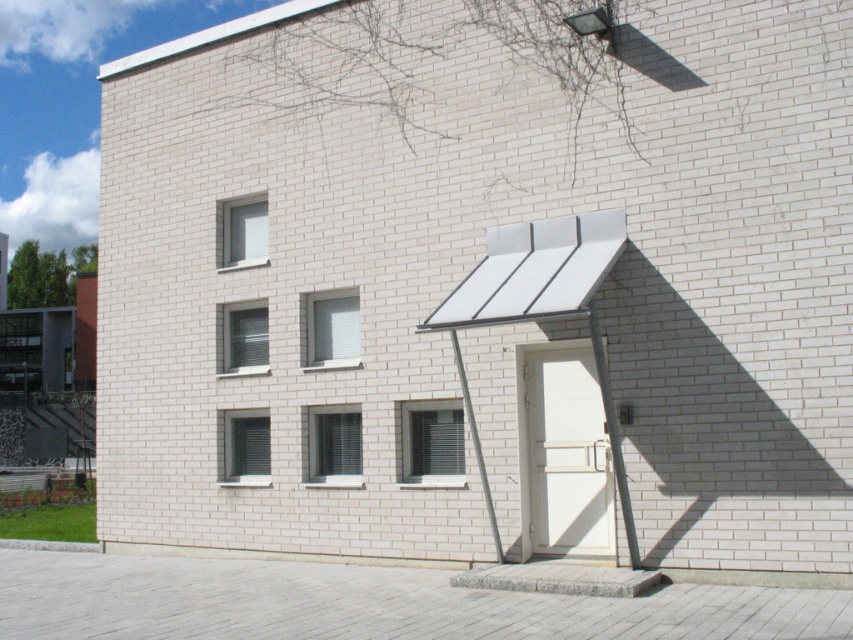
Question: Is white glass window at upper left bigger than metallic gray pole at center?

Choices:
 (A) yes
 (B) no

Answer: (B)

Question: Among these objects, which one is nearest to the camera?

Choices:
 (A) white glass window at upper left
 (B) metallic gray pole at center
 (C) white textured window at lower left
 (D) white glass window at upper center

Answer: (B)

Question: Is white matte window at center thinner than white glass window at upper left?

Choices:
 (A) no
 (B) yes

Answer: (A)

Question: Does white matte window at center have a smaller size compared to white glass window at upper center?

Choices:
 (A) no
 (B) yes

Answer: (B)

Question: Among these objects, which one is farthest from the camera?

Choices:
 (A) clear glass window at center
 (B) white textured window at lower left

Answer: (B)

Question: Which of the following is the farthest from the observer?

Choices:
 (A) (230, 246)
 (B) (229, 468)
 (C) (260, 330)

Answer: (A)